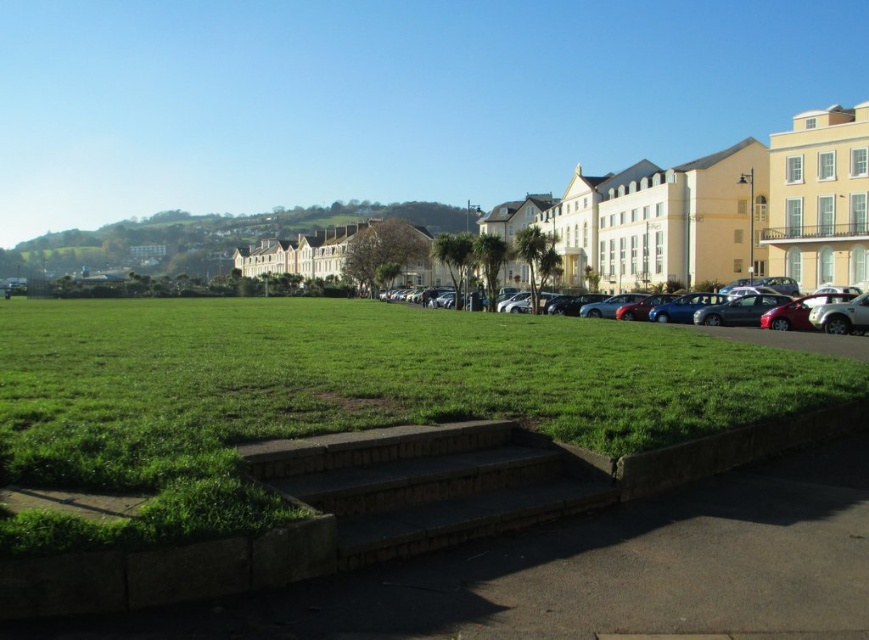
Is point (733, 406) positioned before point (183, 589)?

No, it is not.

Which is in front, point (339, 406) or point (675, 524)?

Positioned in front is point (675, 524).

Find the location of `green grass at center`. green grass at center is located at coordinates (337, 394).

Is brown stone stairs at center to the left of metallic silver car at center from the viewer's perspective?

Indeed, brown stone stairs at center is positioned on the left side of metallic silver car at center.

Between brown stone stairs at center and metallic silver car at center, which one has more height?

metallic silver car at center is taller.

Measure the distance between point (602, 465) and camera.

A distance of 6.50 meters exists between point (602, 465) and camera.

Locate an element on the screen. brown stone stairs at center is located at coordinates (430, 483).

Does green grass at center have a lesser width compared to brown stone stairs at center?

Incorrect, green grass at center's width is not less than brown stone stairs at center's.

Between point (109, 374) and point (516, 486), which one is positioned behind?

The point (109, 374) is more distant.

You are a GUI agent. You are given a task and a screenshot of the screen. Output one action in this format:
    pyautogui.click(x=<x>, y=<y>)
    Task: Click on the green grass at center
    
    Given the screenshot: What is the action you would take?
    pyautogui.click(x=337, y=394)